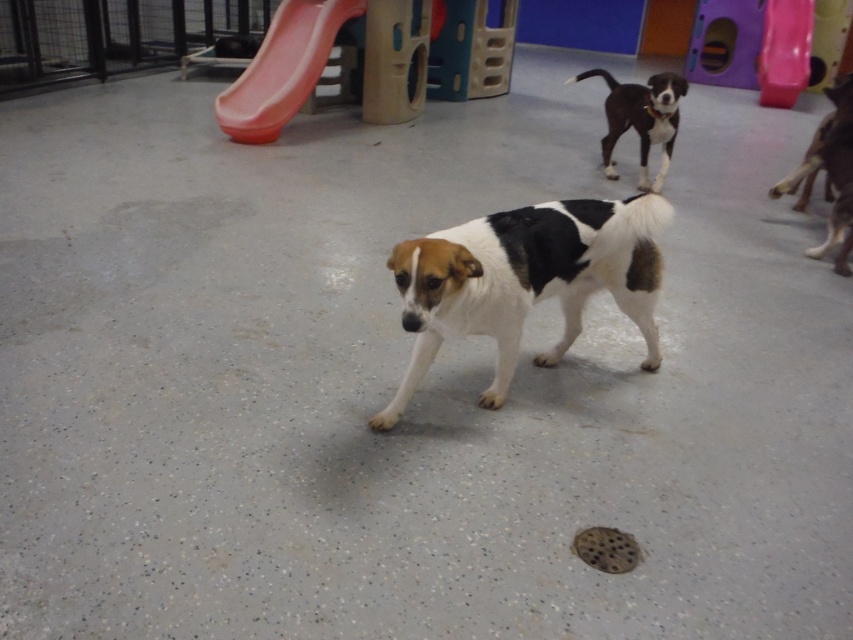
Question: Observing the image, what is the correct spatial positioning of white/black fur dog at center in reference to brown fur at right?

Choices:
 (A) above
 (B) below

Answer: (B)

Question: Can you confirm if rubber slide at upper center is positioned below brown fur at right?

Choices:
 (A) no
 (B) yes

Answer: (A)

Question: Is rubber slide at upper center behind rubber smooth slide at upper right?

Choices:
 (A) yes
 (B) no

Answer: (B)

Question: Among these objects, which one is nearest to the camera?

Choices:
 (A) rubber slide at upper center
 (B) rubber smooth slide at upper right
 (C) white/black fur dog at center

Answer: (C)

Question: Which object is positioned closest to the white/black fur dog at center?

Choices:
 (A) black and white fur at upper right
 (B) rubber smooth slide at upper right

Answer: (A)

Question: Among these objects, which one is farthest from the camera?

Choices:
 (A) rubber slide at upper center
 (B) black and white fur at upper right

Answer: (A)